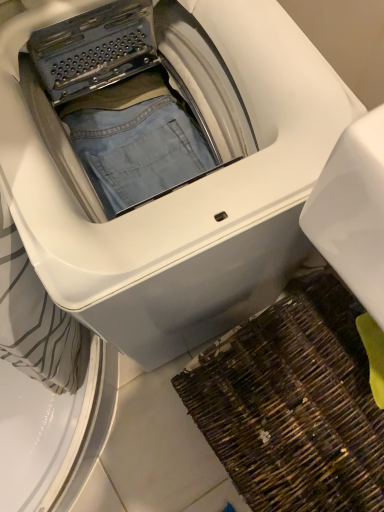
Find the location of `vacant space situated above brown woven mat at lower right (from a real-world perspective)`. vacant space situated above brown woven mat at lower right (from a real-world perspective) is located at coordinates (315, 426).